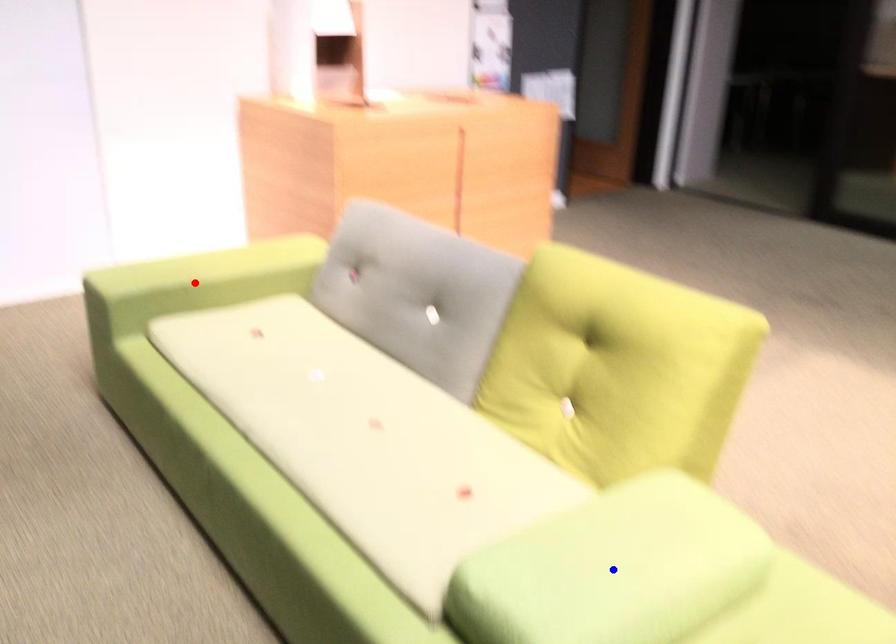
Question: Which of the two points in the image is closer to the camera?

Choices:
 (A) Blue point is closer.
 (B) Red point is closer.

Answer: (A)